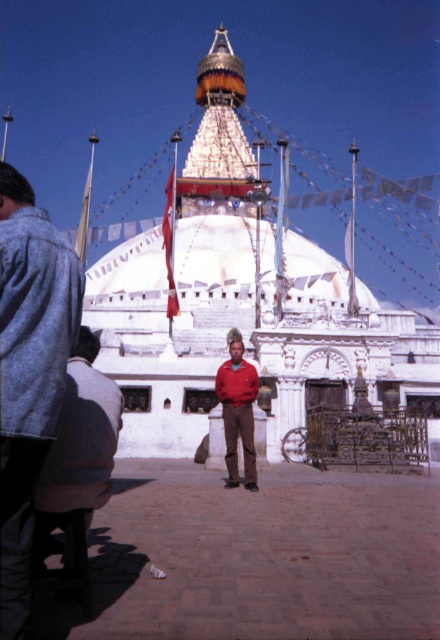
Locate an element on the screen. brushed denim jacket at lower left is located at coordinates (29, 372).

Between red jacket at center and red matte jacket at center, which one has more height?

Standing taller between the two is red jacket at center.

Is red jacket at center bigger than red matte jacket at center?

No.

Between point (44, 467) and point (252, 385), which one is positioned behind?

Positioned behind is point (252, 385).

Identify the location of red jacket at center. This screenshot has height=640, width=440. (81, 436).

Between brushed denim jacket at lower left and red jacket at center, which one has less height?

red jacket at center is shorter.

Where is `brushed denim jacket at lower left`? Image resolution: width=440 pixels, height=640 pixels. brushed denim jacket at lower left is located at coordinates (29, 372).

The height and width of the screenshot is (640, 440). I want to click on brushed denim jacket at lower left, so click(29, 372).